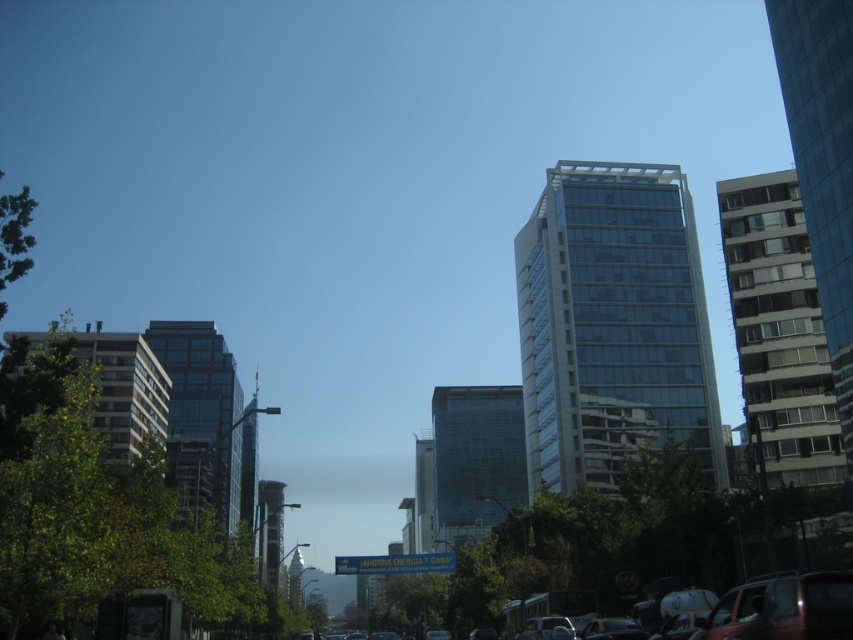
You are standing at the point labeled as point (x=717, y=388) in the image. A friend is at a location 131.10 meters away from you. Where is your friend located relative to the urban scene depicted?

Your friend is located 131.10 meters away from point (x=717, y=388) in the urban scene.